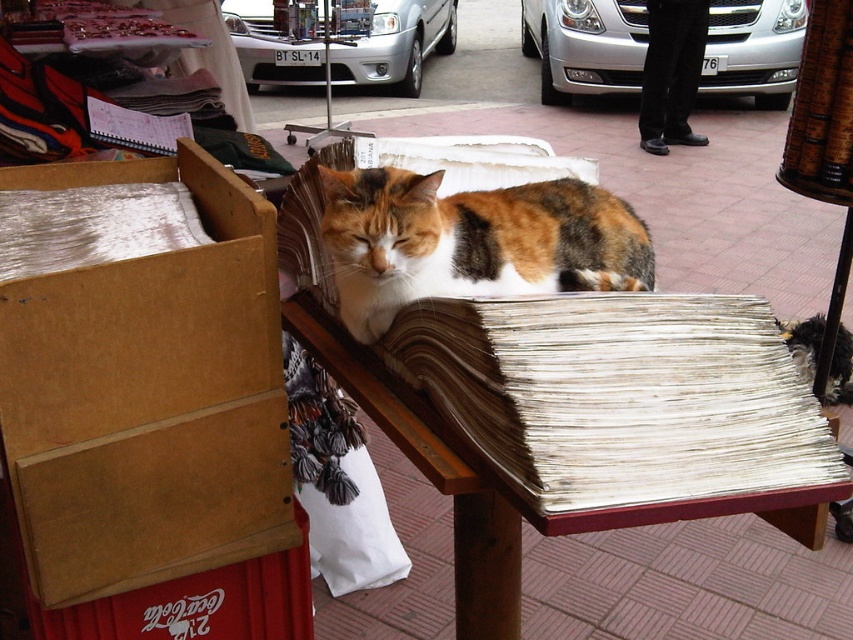
Question: Can you confirm if brown cardboard box at left is positioned below calico fur cat at center?

Choices:
 (A) no
 (B) yes

Answer: (B)

Question: Considering the real-world distances, which object is closest to the metallic silver car at center?

Choices:
 (A) wooden table at center
 (B) calico fur cat at center
 (C) brown cardboard box at left

Answer: (B)

Question: Does calico fur cat at center come behind metallic silver car at center?

Choices:
 (A) no
 (B) yes

Answer: (A)

Question: Does brown cardboard box at left appear over wooden table at center?

Choices:
 (A) no
 (B) yes

Answer: (B)

Question: Which point is farther to the camera?

Choices:
 (A) wooden table at center
 (B) brown cardboard box at left

Answer: (B)

Question: Estimate the real-world distances between objects in this image. Which object is closer to the wooden table at center?

Choices:
 (A) brown cardboard box at left
 (B) calico fur cat at center

Answer: (B)